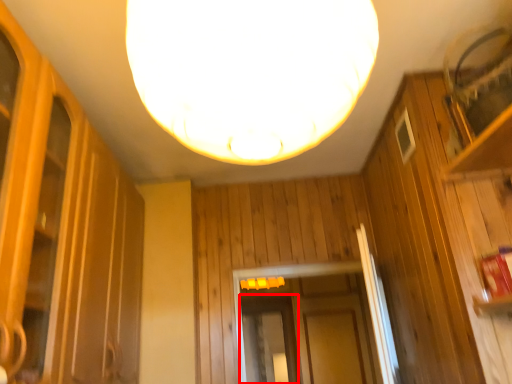
Question: Observing the image, what is the correct spatial positioning of screen door (annotated by the red box) in reference to lamp?

Choices:
 (A) right
 (B) left

Answer: (A)